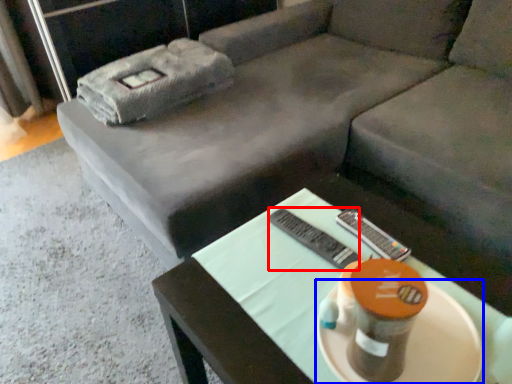
Question: Which point is closer to the camera, remote (highlighted by a red box) or platter (highlighted by a blue box)?

Choices:
 (A) remote
 (B) platter

Answer: (B)